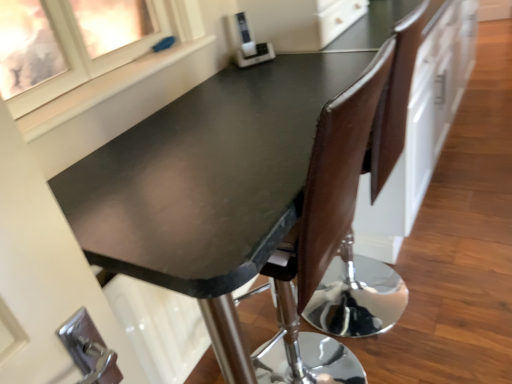
Identify the location of vacant space to the right of white plastic appliance at upper center. (297, 62).